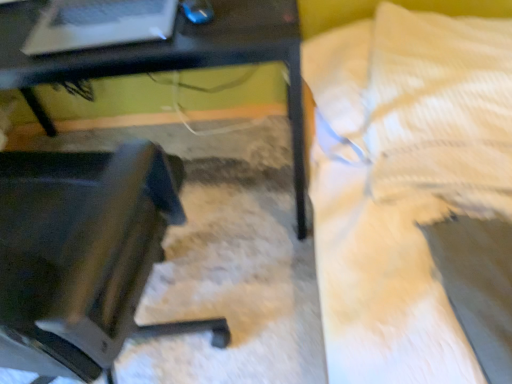
Question: In terms of size, does white textured bed at upper right appear bigger or smaller than matte black laptop at upper left?

Choices:
 (A) small
 (B) big

Answer: (B)

Question: Is white textured bed at upper right taller or shorter than matte black laptop at upper left?

Choices:
 (A) tall
 (B) short

Answer: (A)

Question: Which object is positioned farthest from the black plastic table at center?

Choices:
 (A) white textured pillow at upper right
 (B) matte black laptop at upper left
 (C) black plastic chair at lower left
 (D) white textured bed at upper right

Answer: (A)

Question: Which object is the farthest from the black plastic table at center?

Choices:
 (A) white textured pillow at upper right
 (B) white textured bed at upper right
 (C) matte black laptop at upper left
 (D) black plastic chair at lower left

Answer: (A)